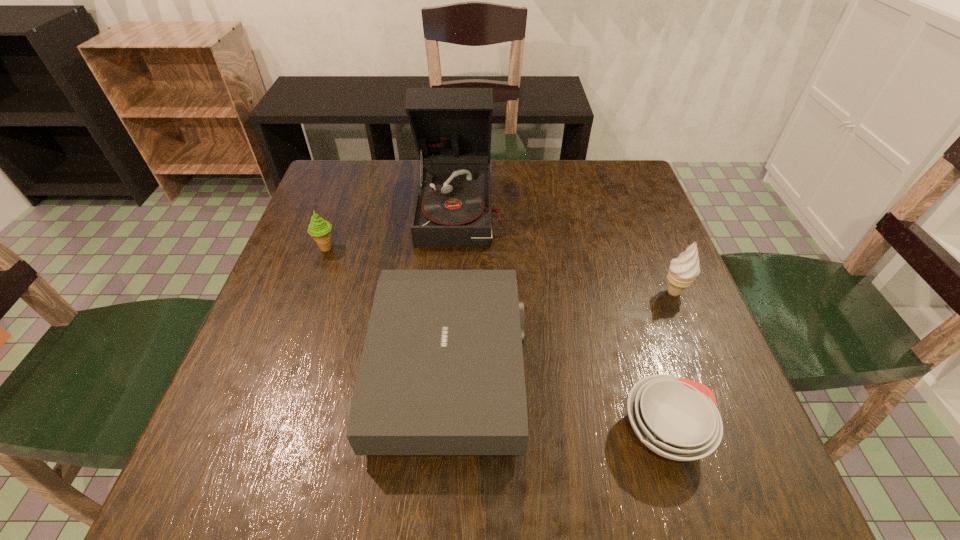
I want to click on empty space that is in between the projector and the fourth shortest object, so click(x=562, y=332).

Where is `unoccupied position between the soup bowl and the projector`? This screenshot has width=960, height=540. unoccupied position between the soup bowl and the projector is located at coordinates (557, 401).

I want to click on free space between the tallest object and the fourth object from left to right, so click(564, 320).

Identify the location of free spot between the soup bowl and the projector. Image resolution: width=960 pixels, height=540 pixels. (557, 401).

Find the location of a particular element. Image resolution: width=960 pixels, height=540 pixels. the second closest object to the leftmost object is located at coordinates (441, 372).

Image resolution: width=960 pixels, height=540 pixels. Identify the location of the fourth closest object to the leftmost object. (683, 270).

The height and width of the screenshot is (540, 960). I want to click on free space that satisfies the following two spatial constraints: 1. on the front-facing side of the second object from right to left; 2. on the left side of the projector, so click(x=446, y=432).

This screenshot has height=540, width=960. What are the coordinates of `blank space that satisfies the following two spatial constraints: 1. on the front-facing side of the tallest object; 2. on the front-facing side of the projector` in the screenshot? It's located at (458, 370).

What are the coordinates of `vacant space that satisfies the following two spatial constraints: 1. on the back side of the shortest object; 2. on the front-facing side of the projector` in the screenshot? It's located at (646, 370).

Identify the location of free space that satisfies the following two spatial constraints: 1. on the front-facing side of the second object from right to left; 2. on the left side of the phonograph_record. Image resolution: width=960 pixels, height=540 pixels. (455, 432).